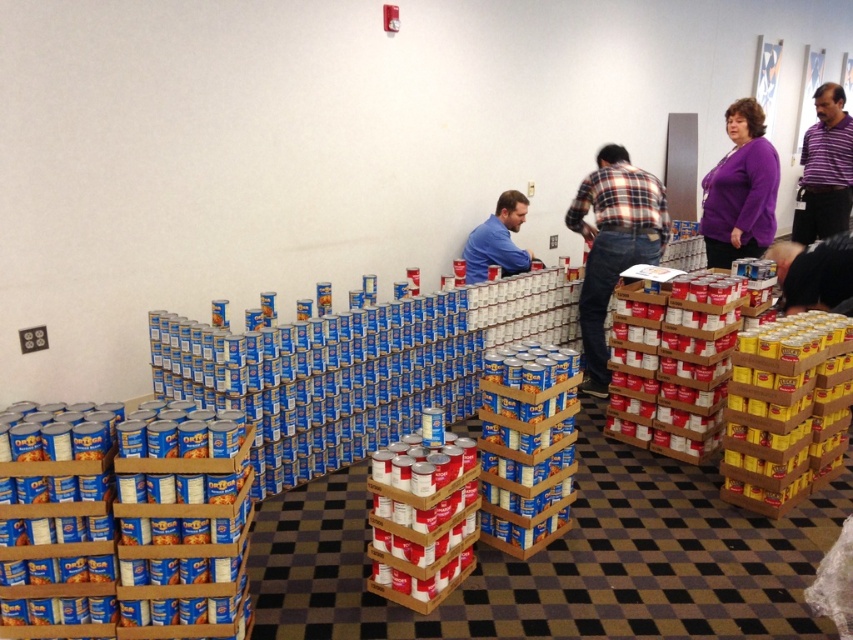
You are a quality inspector in the room and need to check the shirts of the people working. Which of the purple matte shirt at upper right and purple striped polo shirt at upper right is closer to you?

The purple matte shirt at upper right is in front of the purple striped polo shirt at upper right, so the purple matte shirt at upper right is closer to you.

You are standing in the room and want to find the black matte shirt at lower right. According to the coordinates provided, where exactly should you look to locate it?

The black matte shirt at lower right is located at coordinates point (813, 273).